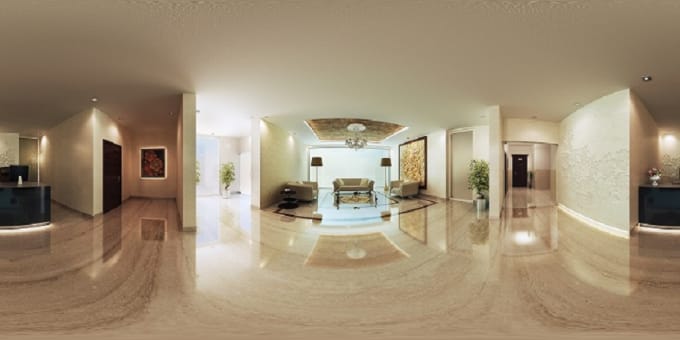
Locate an element on the screen. This screenshot has height=340, width=680. countertop on left side is located at coordinates (20, 201).